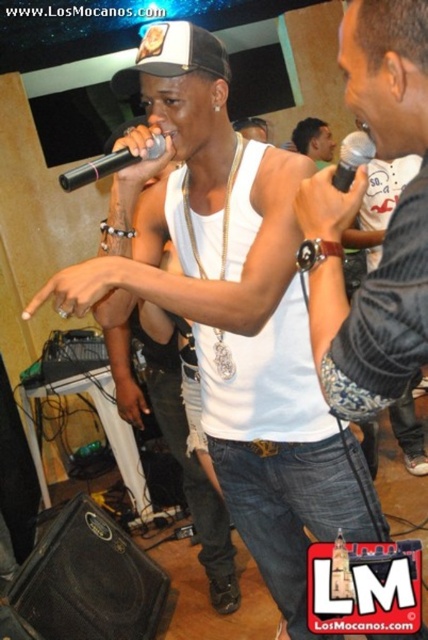
You are a stagehand setting up a new microphone stand that must be placed between the denim jacket at right and the black metallic microphone at center. The stand requires at least 1 meter of space between the two objects to fit properly. Can you determine if there is enough space based on their sizes?

The denim jacket at right is wider than the black metallic microphone at center, but the description does not provide specific measurements of the distance between them. Therefore, it is impossible to determine if there is enough space for the microphone stand based solely on their widths.

As an event planner, you need to place a small decorative item on the stage. The coordinates given are point A at [314,140]. Based on the scene description, what object is located at point A?

The point at [314,140] corresponds to the matte black shirt at center.